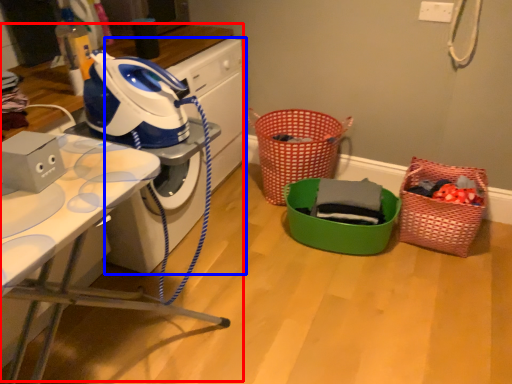
Question: Which object is closer to the camera taking this photo, computer desk (highlighted by a red box) or washing machine (highlighted by a blue box)?

Choices:
 (A) computer desk
 (B) washing machine

Answer: (A)